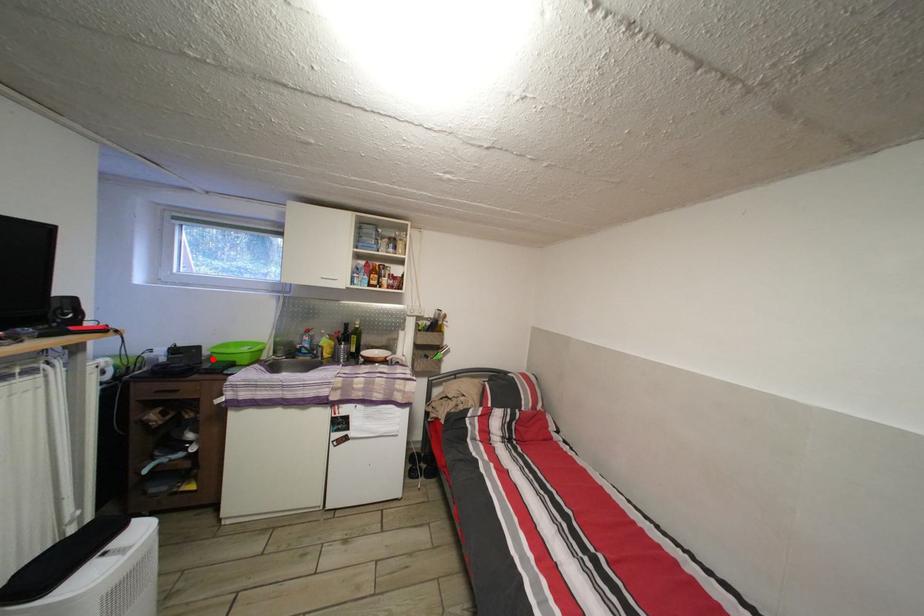
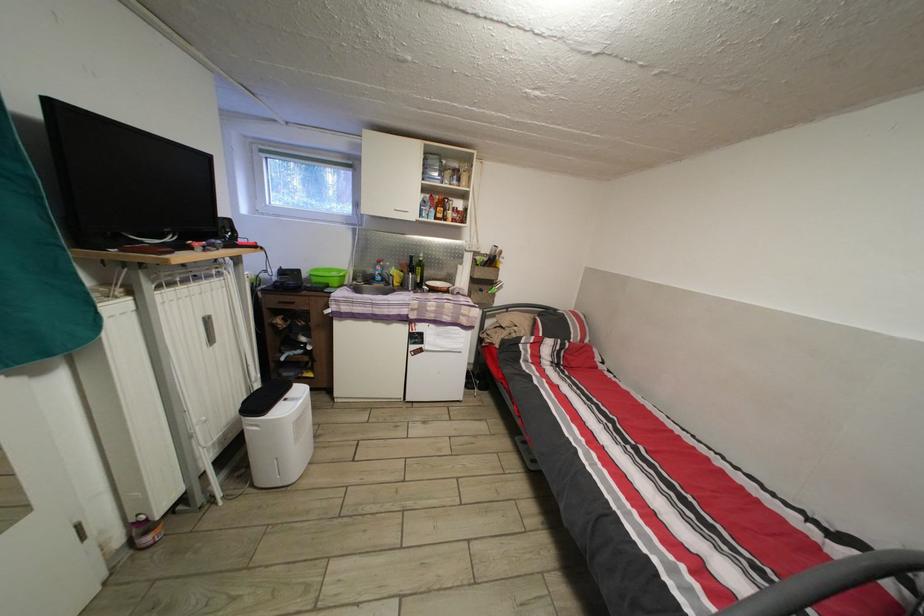
Where in the second image is the point corresponding to the highlighted location from the first image?

(311, 282)